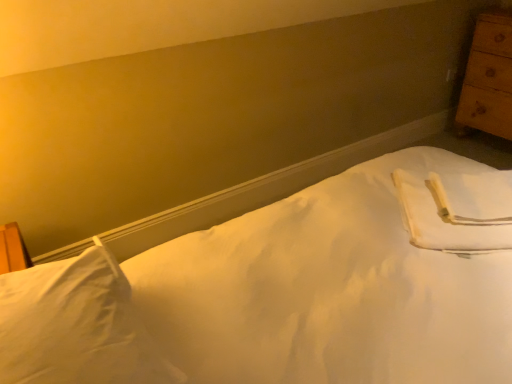
Locate an element on the screen. white smooth bed at center is located at coordinates (279, 295).

What do you see at coordinates (488, 78) in the screenshot?
I see `wooden chest of drawers at right` at bounding box center [488, 78].

Measure the distance between white soft pillow at lower left and camera.

64.50 centimeters.

What are the coordinates of `white smooth bed at center` in the screenshot? It's located at (279, 295).

From the image's perspective, is wooden chest of drawers at right below white smooth bed at center?

No, from the image's perspective, wooden chest of drawers at right is not beneath white smooth bed at center.

Does wooden chest of drawers at right lie behind white smooth bed at center?

Yes, wooden chest of drawers at right is behind white smooth bed at center.

Considering the relative sizes of wooden chest of drawers at right and white smooth bed at center in the image provided, is wooden chest of drawers at right wider than white smooth bed at center?

No, wooden chest of drawers at right is not wider than white smooth bed at center.

Between wooden chest of drawers at right and white smooth bed at center, which one appears on the right side from the viewer's perspective?

Positioned to the right is wooden chest of drawers at right.

Could you tell me if white soft pillow at lower left is turned towards white smooth bed at center?

Yes, white soft pillow at lower left is aimed at white smooth bed at center.

I want to click on bed below the white soft pillow at lower left (from a real-world perspective), so click(x=279, y=295).

Considering the relative positions of white soft pillow at lower left and white smooth bed at center in the image provided, is white soft pillow at lower left to the left or to the right of white smooth bed at center?

white soft pillow at lower left is positioned on white smooth bed at center's left side.

Looking at this image, from a real-world perspective, which object stands above the other?

From a 3D spatial view, white soft pillow at lower left is above.

Is wooden chest of drawers at right spatially inside white soft pillow at lower left, or outside of it?

wooden chest of drawers at right is not inside white soft pillow at lower left, it's outside.

Which object is positioned more to the right, wooden chest of drawers at right or white soft pillow at lower left?

Positioned to the right is wooden chest of drawers at right.

Is wooden chest of drawers at right next to white soft pillow at lower left?

wooden chest of drawers at right is not next to white soft pillow at lower left, and they're not touching.

Can you confirm if white smooth bed at center is wider than white soft pillow at lower left?

Correct, the width of white smooth bed at center exceeds that of white soft pillow at lower left.

Where is `pillow that is above the white smooth bed at center (from the image's perspective)`? This screenshot has height=384, width=512. pillow that is above the white smooth bed at center (from the image's perspective) is located at coordinates (76, 326).

Is white smooth bed at center facing towards white soft pillow at lower left?

No, white smooth bed at center is not aimed at white soft pillow at lower left.

Considering the relative sizes of white smooth bed at center and white soft pillow at lower left in the image provided, is white smooth bed at center smaller than white soft pillow at lower left?

No.

Which of these two, white soft pillow at lower left or wooden chest of drawers at right, is smaller?

white soft pillow at lower left.

Between white soft pillow at lower left and wooden chest of drawers at right, which one has less height?

white soft pillow at lower left.

Considering the sizes of objects white soft pillow at lower left and wooden chest of drawers at right in the image provided, who is thinner, white soft pillow at lower left or wooden chest of drawers at right?

Thinner between the two is wooden chest of drawers at right.

Do you think white soft pillow at lower left is within wooden chest of drawers at right, or outside of it?

white soft pillow at lower left is outside wooden chest of drawers at right.

Does white smooth bed at center turn towards wooden chest of drawers at right?

Yes, white smooth bed at center is facing wooden chest of drawers at right.

Is white smooth bed at center with wooden chest of drawers at right?

white smooth bed at center and wooden chest of drawers at right are clearly separated.

Does white smooth bed at center have a larger size compared to wooden chest of drawers at right?

Indeed, white smooth bed at center has a larger size compared to wooden chest of drawers at right.

I want to click on bed in front of the wooden chest of drawers at right, so click(279, 295).

Identify the location of bed below the white soft pillow at lower left (from a real-world perspective). point(279,295).

Estimate the real-world distances between objects in this image. Which object is further from wooden chest of drawers at right, white smooth bed at center or white soft pillow at lower left?

white soft pillow at lower left.

Considering their positions, is wooden chest of drawers at right positioned further to white smooth bed at center than white soft pillow at lower left?

Among the two, wooden chest of drawers at right is located further to white smooth bed at center.

Looking at this image, from the image, which object appears to be farther from white soft pillow at lower left, wooden chest of drawers at right or white smooth bed at center?

wooden chest of drawers at right is positioned further to the anchor white soft pillow at lower left.

From the image, which object appears to be farther from white soft pillow at lower left, white smooth bed at center or wooden chest of drawers at right?

wooden chest of drawers at right is further to white soft pillow at lower left.

Which object lies nearer to the anchor point white smooth bed at center, white soft pillow at lower left or wooden chest of drawers at right?

Among the two, white soft pillow at lower left is located nearer to white smooth bed at center.

Considering their positions, is white soft pillow at lower left positioned further to wooden chest of drawers at right than white smooth bed at center?

Among the two, white soft pillow at lower left is located further to wooden chest of drawers at right.

Locate an element on the screen. bed between white soft pillow at lower left and wooden chest of drawers at right is located at coordinates (279, 295).